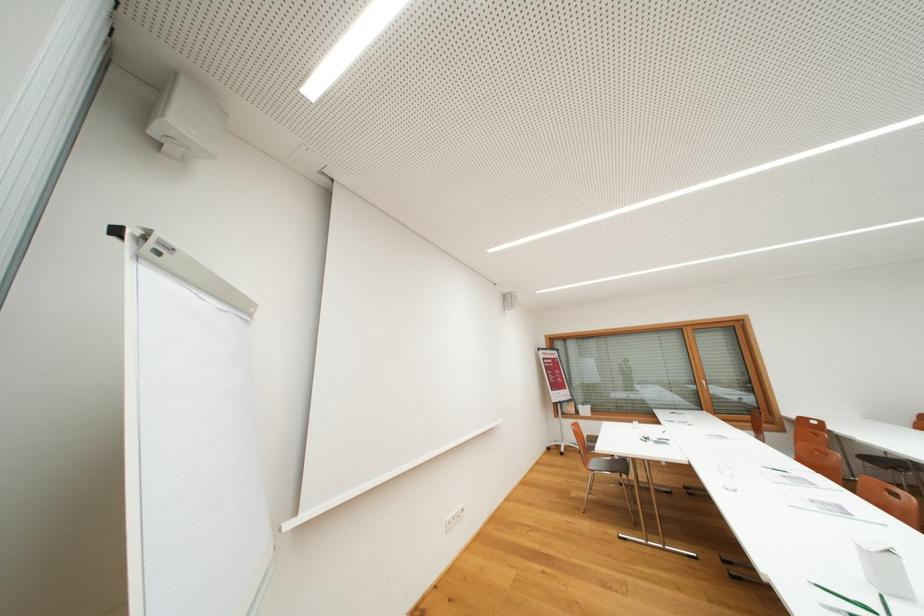
This screenshot has height=616, width=924. What do you see at coordinates (602, 469) in the screenshot?
I see `the chair sitting surface` at bounding box center [602, 469].